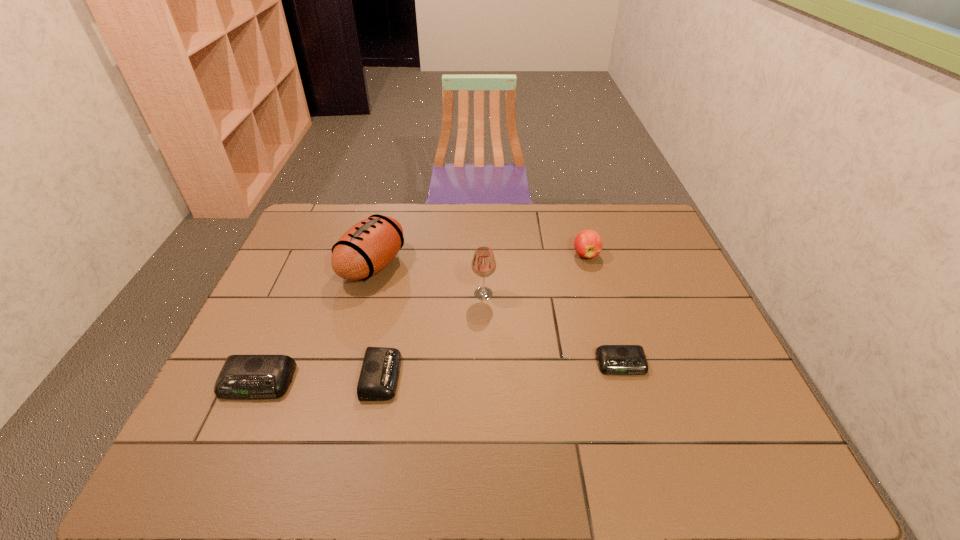
Where is `free space located 0.070m on the display of the rightmost alarm clock`? The image size is (960, 540). free space located 0.070m on the display of the rightmost alarm clock is located at coordinates (633, 401).

The width and height of the screenshot is (960, 540). Find the location of `vacant area located 0.060m on the left of the football (American)`. vacant area located 0.060m on the left of the football (American) is located at coordinates (322, 266).

Identify the location of free region located on the left of the apple. (463, 254).

This screenshot has width=960, height=540. I want to click on free space located 0.370m on the right of the third object from right to left, so 620,294.

What are the coordinates of `object that is at the far edge` in the screenshot? It's located at (366, 248).

Locate an element on the screen. object that is at the left edge is located at coordinates (242, 376).

This screenshot has height=540, width=960. I want to click on object present at the near left corner, so [x=242, y=376].

This screenshot has height=540, width=960. Identify the location of free region at the far edge of the desktop. (605, 210).

I want to click on free space at the near edge of the desktop, so click(x=291, y=410).

In the image, there is a desktop. Where is `vacant space at the left edge`? The height and width of the screenshot is (540, 960). vacant space at the left edge is located at coordinates (300, 346).